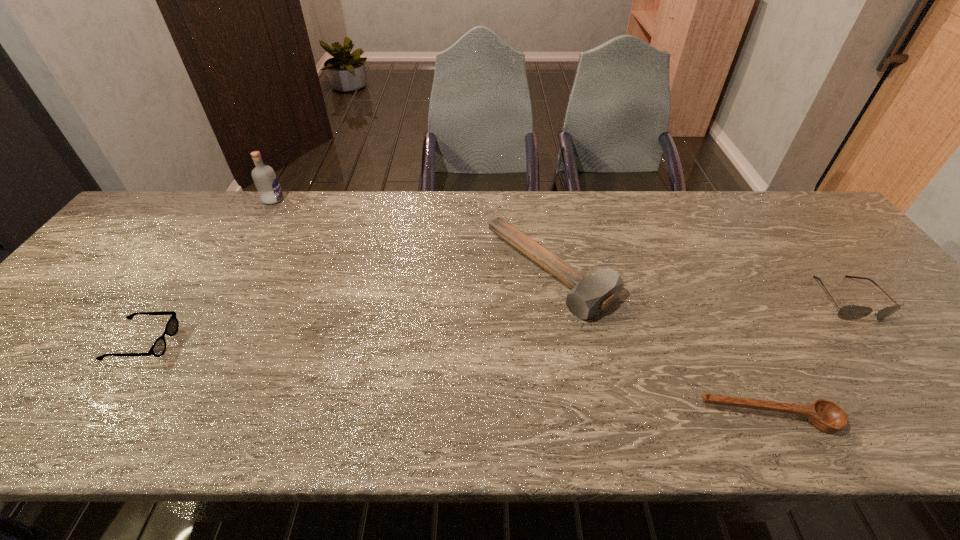
Find the location of a particular element. This screenshot has width=960, height=540. free space that satisfies the following two spatial constraints: 1. on the back side of the nearest object; 2. on the arms of the spectacles is located at coordinates (732, 342).

Where is `vacant space that satisfies the following two spatial constraints: 1. on the label of the farthest object; 2. on the right side of the second object from right to left`? The image size is (960, 540). vacant space that satisfies the following two spatial constraints: 1. on the label of the farthest object; 2. on the right side of the second object from right to left is located at coordinates (149, 418).

At what (x,y) coordinates should I click in order to perform the action: click on vacant space that satisfies the following two spatial constraints: 1. on the front-facing side of the rightmost object; 2. on the arms of the spectacles. Please return your answer as a coordinate pair (x, y). This screenshot has width=960, height=540. Looking at the image, I should click on (880, 342).

At what (x,y) coordinates should I click in order to perform the action: click on free space that satisfies the following two spatial constraints: 1. on the arms of the spectacles; 2. on the left side of the shortest object. Please return your answer as a coordinate pair (x, y). This screenshot has width=960, height=540. Looking at the image, I should click on (93, 418).